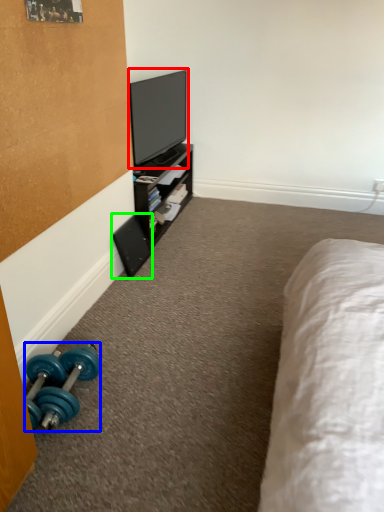
Question: Based on their relative distances, which object is farther from television (highlighted by a red box)? Choose from dumbbell (highlighted by a blue box) and speaker (highlighted by a green box).

Choices:
 (A) dumbbell
 (B) speaker

Answer: (A)